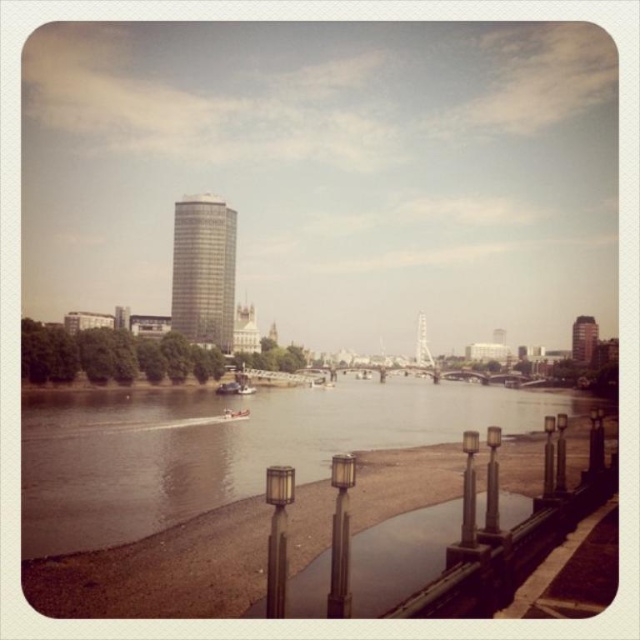
Question: Based on their relative distances, which object is farther from the brown water at center?

Choices:
 (A) silver glass tower at center
 (B) metallic glass tower at upper right

Answer: (B)

Question: Can you confirm if brown water at center is smaller than silver glass tower at center?

Choices:
 (A) no
 (B) yes

Answer: (A)

Question: Can you confirm if brown water at center is smaller than metallic glass tower at upper right?

Choices:
 (A) yes
 (B) no

Answer: (B)

Question: Which of the following is the farthest from the observer?

Choices:
 (A) (211, 241)
 (B) (589, 321)
 (C) (570, 412)

Answer: (B)

Question: Which point is closer to the camera?

Choices:
 (A) [228, 275]
 (B) [588, 353]
 (C) [298, 408]

Answer: (C)

Question: Does brown water at center appear over silver glass tower at center?

Choices:
 (A) no
 (B) yes

Answer: (A)